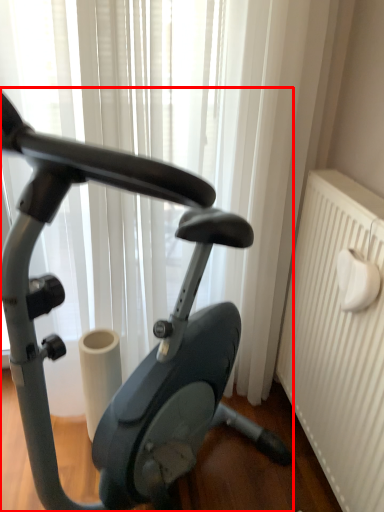
Question: Where is stationary bicycle (annotated by the red box) located in relation to radiator in the image?

Choices:
 (A) left
 (B) right

Answer: (A)